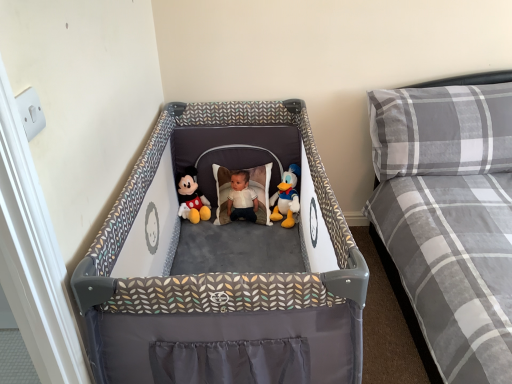
Measure the distance between gray plaid mattress at right and camera.

The distance of gray plaid mattress at right from camera is 1.01 meters.

Identify the location of gray plaid mattress at right. (454, 266).

What do you see at coordinates (286, 198) in the screenshot? I see `white plush duck at center, which appears as the 2th toy when viewed from the left` at bounding box center [286, 198].

Measure the distance between matte plush mickey mouse at center, which is counted as the second toy, starting from the right, and camera.

They are 7.00 feet apart.

What are the coordinates of `gray plaid mattress at right` in the screenshot? It's located at (454, 266).

In the image, is gray plaid pillow at upper right positioned in front of or behind gray plaid mattress at right?

In the image, gray plaid pillow at upper right appears behind gray plaid mattress at right.

From a real-world perspective, who is located higher, gray plaid pillow at upper right or gray plaid mattress at right?

gray plaid pillow at upper right is physically above.

Is gray plaid mattress at right at the back of gray plaid pillow at upper right?

Correct, gray plaid pillow at upper right is looking away from gray plaid mattress at right.

From a real-world perspective, is matte plush mickey mouse at center, arranged as the 1th toy when viewed from the left, beneath gray plaid pillow at upper right?

Yes, from a real-world perspective, matte plush mickey mouse at center, arranged as the 1th toy when viewed from the left, is under gray plaid pillow at upper right.

Does point (194, 177) appear closer or farther from the camera than point (437, 106)?

Point (194, 177) is farther from the camera than point (437, 106).

In the scene shown: Considering the relative positions of matte plush mickey mouse at center, which is counted as the second toy, starting from the right, and gray plaid pillow at upper right in the image provided, is matte plush mickey mouse at center, which is counted as the second toy, starting from the right, to the right of gray plaid pillow at upper right from the viewer's perspective?

No, matte plush mickey mouse at center, which is counted as the second toy, starting from the right, is not to the right of gray plaid pillow at upper right.

From the image's perspective, relative to gray plaid pillow at upper right, is matte plush mickey mouse at center, arranged as the 1th toy when viewed from the left, above or below?

Clearly, from the image's perspective, matte plush mickey mouse at center, arranged as the 1th toy when viewed from the left, is below gray plaid pillow at upper right.

Can you tell me how much matte plush mickey mouse at center, which is counted as the second toy, starting from the right, and gray plaid mattress at right differ in facing direction?

The facing directions of matte plush mickey mouse at center, which is counted as the second toy, starting from the right, and gray plaid mattress at right are 3.24 degrees apart.

From a real-world perspective, is matte plush mickey mouse at center, arranged as the 1th toy when viewed from the left, positioned under gray plaid mattress at right based on gravity?

Yes, from a real-world perspective, matte plush mickey mouse at center, arranged as the 1th toy when viewed from the left, is below gray plaid mattress at right.

Is matte plush mickey mouse at center, which is counted as the second toy, starting from the right, far from gray plaid mattress at right?

matte plush mickey mouse at center, which is counted as the second toy, starting from the right, is far away from gray plaid mattress at right.

Could you tell me if matte plush mickey mouse at center, arranged as the 1th toy when viewed from the left, is facing gray plaid mattress at right?

No, matte plush mickey mouse at center, arranged as the 1th toy when viewed from the left, is not facing towards gray plaid mattress at right.

Consider the image. Choose the correct answer: Is gray plaid pillow at upper right inside white plush duck at center, the 1th toy when ordered from right to left, or outside it?

gray plaid pillow at upper right is not enclosed by white plush duck at center, the 1th toy when ordered from right to left.

Can you tell me how much gray plaid pillow at upper right and white plush duck at center, the 1th toy when ordered from right to left, differ in facing direction?

There is a 3.06-degree angle between the facing directions of gray plaid pillow at upper right and white plush duck at center, the 1th toy when ordered from right to left.

Does gray plaid pillow at upper right touch white plush duck at center, which appears as the 2th toy when viewed from the left?

No, gray plaid pillow at upper right is not in contact with white plush duck at center, which appears as the 2th toy when viewed from the left.

From a real-world perspective, who is located higher, gray plaid pillow at upper right or white plush duck at center, the 1th toy when ordered from right to left?

gray plaid pillow at upper right is physically above.

From a real-world perspective, is gray plaid mattress at right above or below gray plaid pillow at upper right?

In terms of real-world spatial position, gray plaid mattress at right is below gray plaid pillow at upper right.

From the image's perspective, between gray plaid mattress at right and gray plaid pillow at upper right, which one is located above?

gray plaid pillow at upper right.

Is gray plaid mattress at right turned away from gray plaid pillow at upper right?

Yes, gray plaid pillow at upper right is at the back of gray plaid mattress at right.

Between gray plaid mattress at right and gray plaid pillow at upper right, which one has more height?

Standing taller between the two is gray plaid mattress at right.

Is gray plaid pillow at upper right bigger or smaller than matte plush mickey mouse at center, which is counted as the second toy, starting from the right?

Clearly, gray plaid pillow at upper right is larger in size than matte plush mickey mouse at center, which is counted as the second toy, starting from the right.

Is gray plaid pillow at upper right at the left side of matte plush mickey mouse at center, arranged as the 1th toy when viewed from the left?

No, gray plaid pillow at upper right is not to the left of matte plush mickey mouse at center, arranged as the 1th toy when viewed from the left.

Does gray plaid pillow at upper right come behind matte plush mickey mouse at center, arranged as the 1th toy when viewed from the left?

No, it is not.

Would you consider white plush duck at center, which appears as the 2th toy when viewed from the left, to be distant from gray plaid pillow at upper right?

No, white plush duck at center, which appears as the 2th toy when viewed from the left, is in close proximity to gray plaid pillow at upper right.

From a real-world perspective, is white plush duck at center, the 1th toy when ordered from right to left, physically above gray plaid pillow at upper right?

Actually, white plush duck at center, the 1th toy when ordered from right to left, is physically below gray plaid pillow at upper right in the real world.

In the image, is white plush duck at center, the 1th toy when ordered from right to left, on the left side or the right side of gray plaid pillow at upper right?

From the image, it's evident that white plush duck at center, the 1th toy when ordered from right to left, is to the left of gray plaid pillow at upper right.

You are a GUI agent. You are given a task and a screenshot of the screen. Output one action in this format:
    pyautogui.click(x=<x>, y=<y>)
    Task: Click on the pillow located behind the gray plaid mattress at right
    
    Given the screenshot: What is the action you would take?
    pyautogui.click(x=441, y=130)

From a real-world perspective, count 2nd toys downward from the gray plaid pillow at upper right and point to it. Please provide its 2D coordinates.

[(189, 192)]

When comparing their distances from white plush duck at center, the 1th toy when ordered from right to left, does gray plaid pillow at upper right or gray plaid mattress at right seem further?

gray plaid mattress at right.

Which object lies further to the anchor point gray plaid pillow at upper right, matte plush mickey mouse at center, arranged as the 1th toy when viewed from the left, or gray plaid mattress at right?

matte plush mickey mouse at center, arranged as the 1th toy when viewed from the left, is further to gray plaid pillow at upper right.

Based on their spatial positions, is matte plush mickey mouse at center, arranged as the 1th toy when viewed from the left, or white plush duck at center, the 1th toy when ordered from right to left, further from gray plaid pillow at upper right?

Among the two, matte plush mickey mouse at center, arranged as the 1th toy when viewed from the left, is located further to gray plaid pillow at upper right.

Estimate the real-world distances between objects in this image. Which object is further from white plush duck at center, which appears as the 2th toy when viewed from the left, gray plaid mattress at right or gray plaid pillow at upper right?

gray plaid mattress at right lies further to white plush duck at center, which appears as the 2th toy when viewed from the left, than the other object.

Considering their positions, is matte plush mickey mouse at center, arranged as the 1th toy when viewed from the left, positioned further to gray plaid mattress at right than white plush duck at center, which appears as the 2th toy when viewed from the left?

matte plush mickey mouse at center, arranged as the 1th toy when viewed from the left, is positioned further to the anchor gray plaid mattress at right.

From the picture: Which object lies further to the anchor point gray plaid mattress at right, white plush duck at center, which appears as the 2th toy when viewed from the left, or matte plush mickey mouse at center, which is counted as the second toy, starting from the right?

The object further to gray plaid mattress at right is matte plush mickey mouse at center, which is counted as the second toy, starting from the right.

Estimate the real-world distances between objects in this image. Which object is closer to gray plaid mattress at right, gray plaid pillow at upper right or white plush duck at center, which appears as the 2th toy when viewed from the left?

gray plaid pillow at upper right lies closer to gray plaid mattress at right than the other object.

From the image, which object appears to be farther from white plush duck at center, the 1th toy when ordered from right to left, matte plush mickey mouse at center, which is counted as the second toy, starting from the right, or gray plaid mattress at right?

gray plaid mattress at right is further to white plush duck at center, the 1th toy when ordered from right to left.

Locate an element on the screen. toy located between gray plaid mattress at right and matte plush mickey mouse at center, which is counted as the second toy, starting from the right, in the depth direction is located at coordinates (286, 198).

The height and width of the screenshot is (384, 512). I want to click on toy between matte plush mickey mouse at center, arranged as the 1th toy when viewed from the left, and gray plaid pillow at upper right, in the horizontal direction, so click(286, 198).

Locate an element on the screen. The height and width of the screenshot is (384, 512). pillow located between matte plush mickey mouse at center, arranged as the 1th toy when viewed from the left, and gray plaid mattress at right in the left-right direction is located at coordinates (441, 130).

This screenshot has height=384, width=512. Find the location of `pillow between gray plaid mattress at right and white plush duck at center, the 1th toy when ordered from right to left, in the front-back direction`. pillow between gray plaid mattress at right and white plush duck at center, the 1th toy when ordered from right to left, in the front-back direction is located at coordinates [x=441, y=130].